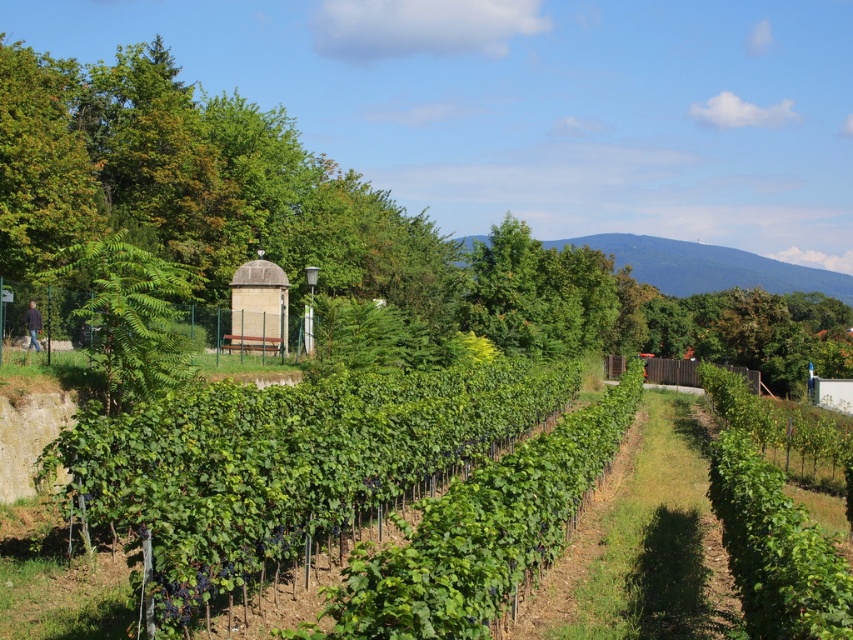
Question: Where is green leafy hedge at center located in relation to blue-green grassy hillside at upper center in the image?

Choices:
 (A) left
 (B) right

Answer: (A)

Question: Among these objects, which one is farthest from the camera?

Choices:
 (A) green leafy tree at left
 (B) blue-green grassy hillside at upper center
 (C) green leafy hedge at center

Answer: (B)

Question: Which of the following is the farthest from the observer?

Choices:
 (A) (137, 344)
 (B) (809, 280)

Answer: (B)

Question: Is green leafy hedge at center wider than green leafy tree at left?

Choices:
 (A) no
 (B) yes

Answer: (A)

Question: Can you confirm if green leafy hedge at center is smaller than green leafy tree at left?

Choices:
 (A) yes
 (B) no

Answer: (A)

Question: Which of the following is the closest to the observer?

Choices:
 (A) (646, 252)
 (B) (199, 484)
 (C) (140, 280)

Answer: (B)